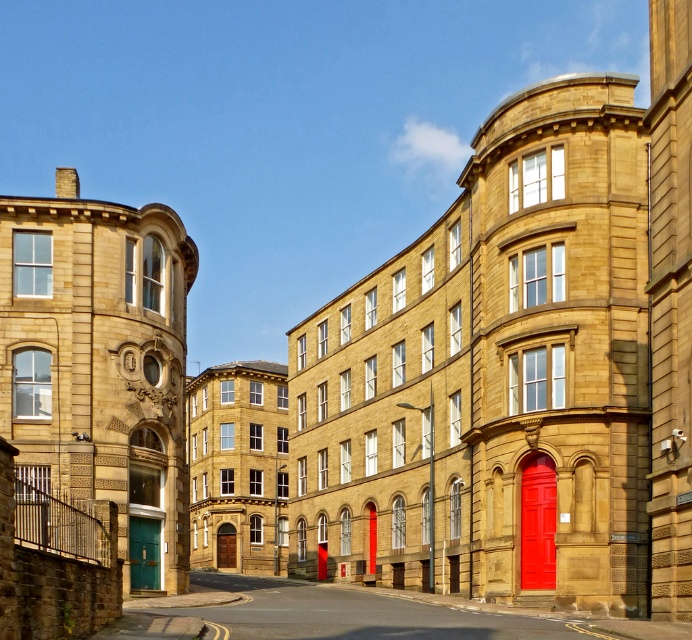
Question: Which point appears closest to the camera in this image?

Choices:
 (A) (154, 525)
 (B) (536, 548)

Answer: (B)

Question: Can you confirm if matte red door at center is positioned to the right of green matte door at lower left?

Choices:
 (A) no
 (B) yes

Answer: (B)

Question: Does matte red door at center have a greater width compared to green matte door at lower left?

Choices:
 (A) no
 (B) yes

Answer: (B)

Question: Which object appears farthest from the camera in this image?

Choices:
 (A) green matte door at lower left
 (B) matte red door at center

Answer: (B)

Question: Which object appears farthest from the camera in this image?

Choices:
 (A) matte red door at center
 (B) green matte door at lower left

Answer: (A)

Question: Is matte red door at center further to the viewer compared to green matte door at lower left?

Choices:
 (A) yes
 (B) no

Answer: (A)